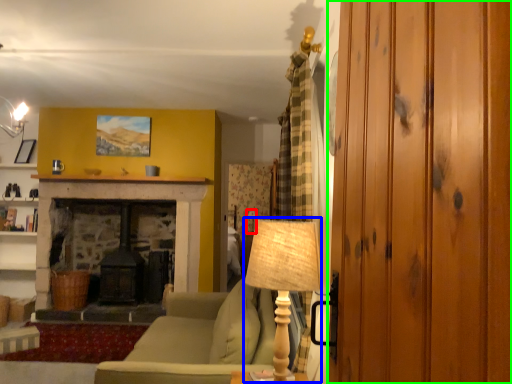
Question: Which is nearer to the table lamp (highlighted by a red box)? table lamp (highlighted by a blue box) or glass door (highlighted by a green box).

Choices:
 (A) table lamp
 (B) glass door

Answer: (A)